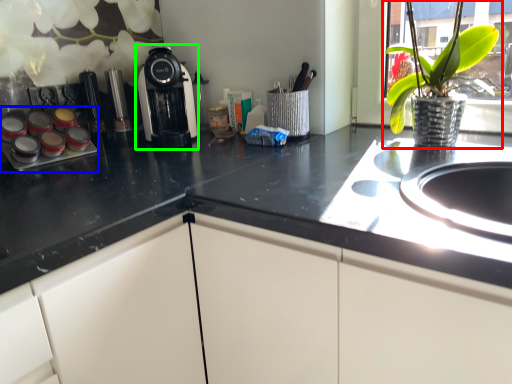
Question: Estimate the real-world distances between objects in this image. Which object is farther from houseplant (highlighted by a red box), appliance (highlighted by a blue box) or kitchen appliance (highlighted by a green box)?

Choices:
 (A) appliance
 (B) kitchen appliance

Answer: (A)